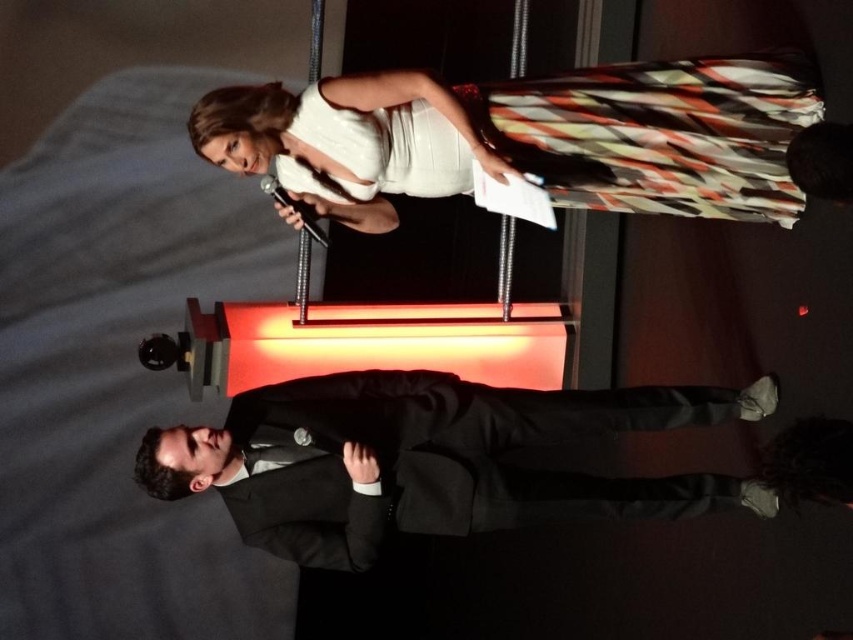
Question: Can you confirm if white satin dress at upper center is positioned above black woolen suit at center?

Choices:
 (A) no
 (B) yes

Answer: (B)

Question: Does white satin dress at upper center lie behind black woolen suit at center?

Choices:
 (A) yes
 (B) no

Answer: (B)

Question: Does white satin dress at upper center appear on the left side of black woolen suit at center?

Choices:
 (A) no
 (B) yes

Answer: (A)

Question: Which of the following is the farthest from the observer?

Choices:
 (A) (674, 186)
 (B) (601, 397)

Answer: (A)